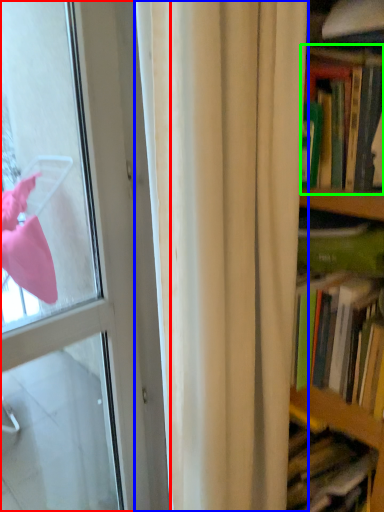
Question: Based on their relative distances, which object is farther from door (highlighted by a red box)? Choose from curtain (highlighted by a blue box) and book (highlighted by a green box).

Choices:
 (A) curtain
 (B) book

Answer: (B)